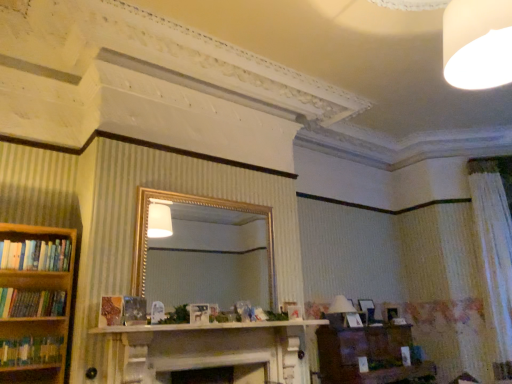
Question: In the image, is white frosted bulb at upper right positioned in front of or behind white marble mantle at center?

Choices:
 (A) behind
 (B) front

Answer: (B)

Question: From the image's perspective, relative to white marble mantle at center, is white frosted bulb at upper right above or below?

Choices:
 (A) below
 (B) above

Answer: (B)

Question: Estimate the real-world distances between objects in this image. Which object is farther from the brown wooden vanity at lower right?

Choices:
 (A) hardcover books at left, which is the 2th book from top to bottom
 (B) white frosted bulb at upper right
 (C) gold-framed mirror at center
 (D) white textured curtain at right
 (E) white marble mantle at center

Answer: (B)

Question: Which is farther from the hardcover books at left, the 1th book in the top-to-bottom sequence?

Choices:
 (A) hardcover books at left, which is the 2th book from top to bottom
 (B) hardcover books at left, marked as the 1th book in a bottom-to-top arrangement
 (C) white marble mantle at center
 (D) gold-framed mirror at center
 (E) white textured curtain at right

Answer: (E)